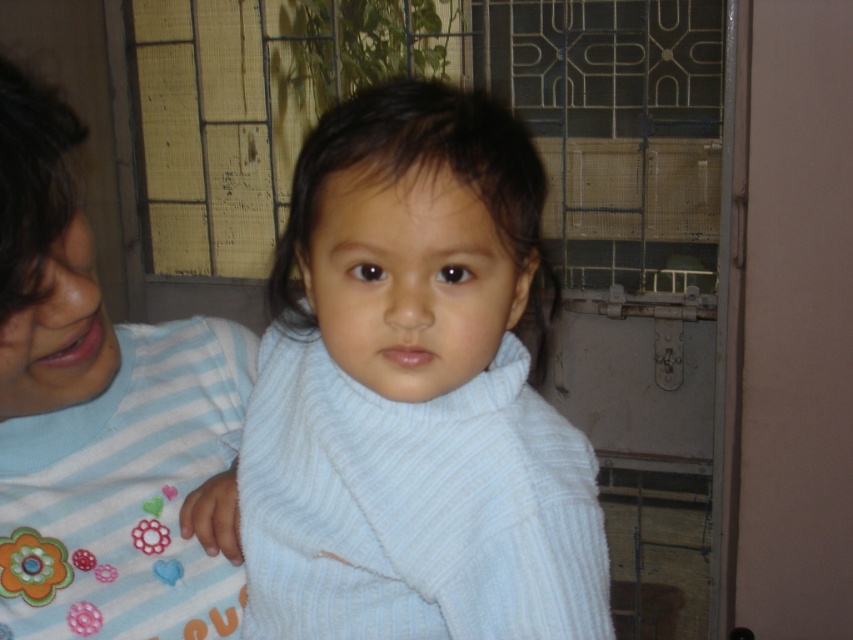
Question: Considering the relative positions of light blue ribbed sweater at center and blue striped shirt at left in the image provided, where is light blue ribbed sweater at center located with respect to blue striped shirt at left?

Choices:
 (A) left
 (B) right

Answer: (B)

Question: Which point is farther to the camera?

Choices:
 (A) (91, 513)
 (B) (351, 131)

Answer: (A)

Question: Is light blue ribbed sweater at center closer to camera compared to blue striped shirt at left?

Choices:
 (A) yes
 (B) no

Answer: (B)

Question: Which of the following is the farthest from the observer?

Choices:
 (A) (523, 525)
 (B) (15, 369)

Answer: (A)

Question: Considering the relative positions of light blue ribbed sweater at center and blue striped shirt at left in the image provided, where is light blue ribbed sweater at center located with respect to blue striped shirt at left?

Choices:
 (A) left
 (B) right

Answer: (B)